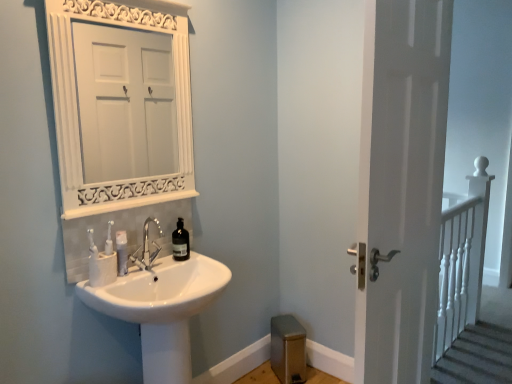
Locate an element on the screen. This screenshot has width=512, height=384. white wooden railing at right is located at coordinates (461, 259).

Measure the distance between point (x=466, y=234) and camera.

They are 2.69 meters apart.

What is the approximate width of white matte toothpaste tube at sink?

2.42 inches.

This screenshot has height=384, width=512. In order to click on translucent glass bottle at sink in this screenshot , I will do `click(180, 242)`.

The image size is (512, 384). Identify the location of white wooden railing at right. (461, 259).

Does white matte door at right have a larger size compared to white wooden railing at right?

No, white matte door at right is not bigger than white wooden railing at right.

Which object is closer to the camera, white matte door at right or white wooden railing at right?

white matte door at right.

Between white matte door at right and white wooden railing at right, which one has smaller width?

white matte door at right is thinner.

Is white matte door at right positioned with its back to white wooden railing at right?

white matte door at right is not turned away from white wooden railing at right.

From the image's perspective, is white glossy sink at lower left over translucent glass bottle at sink?

No.

Which of these two, white glossy sink at lower left or translucent glass bottle at sink, is smaller?

translucent glass bottle at sink.

Looking at this image, could you tell me if white glossy sink at lower left is turned towards translucent glass bottle at sink?

No, white glossy sink at lower left is not aimed at translucent glass bottle at sink.

Is white glossy sink at lower left at the right side of white wooden railing at right?

Incorrect, white glossy sink at lower left is not on the right side of white wooden railing at right.

From a real-world perspective, which object rests below the other?

white glossy sink at lower left.

Is the depth of white glossy sink at lower left greater than that of white wooden railing at right?

No.

Is white matte toothpaste tube at sink closer to camera compared to white glossy sink at lower left?

No.

Considering the sizes of objects white matte toothpaste tube at sink and white glossy sink at lower left in the image provided, who is shorter, white matte toothpaste tube at sink or white glossy sink at lower left?

Standing shorter between the two is white matte toothpaste tube at sink.

Is white matte toothpaste tube at sink with white glossy sink at lower left?

No, white matte toothpaste tube at sink is not with white glossy sink at lower left.

Is white matte toothpaste tube at sink facing towards white glossy sink at lower left?

No.

Considering the relative sizes of white matte door at right and white glossy sink at lower left in the image provided, is white matte door at right smaller than white glossy sink at lower left?

Actually, white matte door at right might be larger than white glossy sink at lower left.

In the scene shown: Which is more to the right, white matte door at right or white glossy sink at lower left?

white matte door at right is more to the right.

Is point (448, 63) farther from viewer compared to point (173, 380)?

That is True.

Is white matte door at right positioned in front of white glossy sink at lower left?

Yes, white matte door at right is closer to the viewer.

Is white matte toothpaste tube at sink turned away from translucent glass bottle at sink?

No.

Where is `bottle that appears above the white matte toothpaste tube at sink (from a real-world perspective)`? bottle that appears above the white matte toothpaste tube at sink (from a real-world perspective) is located at coordinates (x=180, y=242).

From a real-world perspective, is white matte toothpaste tube at sink located beneath translucent glass bottle at sink?

Yes, from a real-world perspective, white matte toothpaste tube at sink is beneath translucent glass bottle at sink.

Considering the relative sizes of white matte toothpaste tube at sink and translucent glass bottle at sink in the image provided, is white matte toothpaste tube at sink thinner than translucent glass bottle at sink?

Yes.

Is polished chrome faucet at sink center oriented away from white wooden railing at right?

No, polished chrome faucet at sink center's orientation is not away from white wooden railing at right.

Which object is more forward, polished chrome faucet at sink center or white wooden railing at right?

polished chrome faucet at sink center is more forward.

Who is shorter, polished chrome faucet at sink center or white wooden railing at right?

polished chrome faucet at sink center is shorter.

From a real-world perspective, which object stands above the other?

polished chrome faucet at sink center is physically above.

Locate an element on the screen. This screenshot has height=384, width=512. screen door that is on the left side of white wooden railing at right is located at coordinates (402, 186).

Where is `bottle above the white glossy sink at lower left (from a real-world perspective)`? bottle above the white glossy sink at lower left (from a real-world perspective) is located at coordinates (180, 242).

When comparing their distances from white matte toothpaste tube at sink, does polished chrome faucet at sink center or translucent glass bottle at sink seem further?

Based on the image, translucent glass bottle at sink appears to be further to white matte toothpaste tube at sink.

Which object lies nearer to the anchor point white matte door at right, white matte toothpaste tube at sink or translucent glass bottle at sink?

Based on the image, translucent glass bottle at sink appears to be nearer to white matte door at right.

Considering their positions, is translucent glass bottle at sink positioned closer to white matte door at right than white matte toothpaste tube at sink?

translucent glass bottle at sink.

Considering their positions, is white matte door at right positioned closer to white matte toothpaste tube at sink than white glossy sink at lower left?

Based on the image, white glossy sink at lower left appears to be nearer to white matte toothpaste tube at sink.

Based on their spatial positions, is polished chrome faucet at sink center or white matte toothpaste tube at sink closer to white wooden railing at right?

The object closer to white wooden railing at right is polished chrome faucet at sink center.

Estimate the real-world distances between objects in this image. Which object is closer to white matte toothpaste tube at sink, white glossy sink at lower left or white matte door at right?

Among the two, white glossy sink at lower left is located nearer to white matte toothpaste tube at sink.

Considering their positions, is white wooden railing at right positioned closer to white glossy sink at lower left than white matte door at right?

white matte door at right is positioned closer to the anchor white glossy sink at lower left.

Based on the photo, considering their positions, is translucent glass bottle at sink positioned further to white glossy sink at lower left than white wooden railing at right?

white wooden railing at right is further to white glossy sink at lower left.

Locate an element on the screen. The width and height of the screenshot is (512, 384). toiletry between translucent glass bottle at sink and white glossy sink at lower left in the up-down direction is located at coordinates (122, 252).

Where is `sink between white matte toothpaste tube at sink and white wooden railing at right from left to right`? Image resolution: width=512 pixels, height=384 pixels. sink between white matte toothpaste tube at sink and white wooden railing at right from left to right is located at coordinates (155, 303).

This screenshot has width=512, height=384. Identify the location of bottle between white matte toothpaste tube at sink and white wooden railing at right from left to right. (180, 242).

At what (x,y) coordinates should I click in order to perform the action: click on sink between polished chrome faucet at sink center and white matte door at right from left to right. Please return your answer as a coordinate pair (x, y). Looking at the image, I should click on (155, 303).